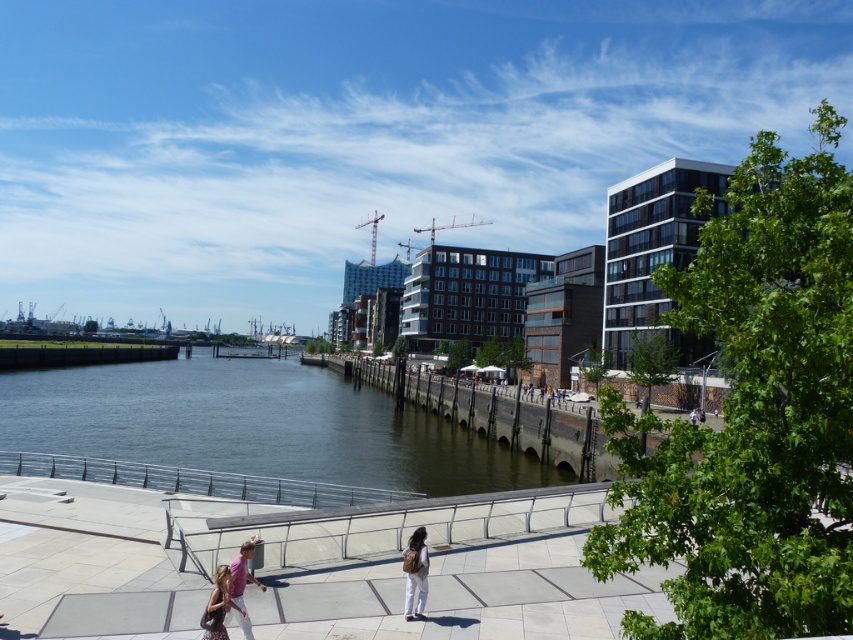
Does light brown backpack at center have a smaller size compared to pink fabric at lower center?

Indeed, light brown backpack at center has a smaller size compared to pink fabric at lower center.

Does light brown backpack at center have a greater width compared to pink fabric at lower center?

No.

Who is more forward, (410, 545) or (241, 579)?

Point (241, 579) is more forward.

The height and width of the screenshot is (640, 853). I want to click on light brown backpack at center, so click(415, 572).

Between dark gray concrete river at center and matte pink backpack at lower left, which one has more height?

With more height is dark gray concrete river at center.

Can you confirm if dark gray concrete river at center is positioned above matte pink backpack at lower left?

No.

Which is in front, point (59, 381) or point (219, 600)?

Point (219, 600)

Find the location of `dark gray concrete river at center`. dark gray concrete river at center is located at coordinates (251, 426).

Does dark gray concrete river at center appear on the right side of light brown backpack at center?

Incorrect, dark gray concrete river at center is not on the right side of light brown backpack at center.

Can you confirm if dark gray concrete river at center is thinner than light brown backpack at center?

In fact, dark gray concrete river at center might be wider than light brown backpack at center.

Does point (244, 429) lie in front of point (422, 595)?

No, it is behind (422, 595).

At what (x,y) coordinates should I click in order to perform the action: click on dark gray concrete river at center. Please return your answer as a coordinate pair (x, y). Looking at the image, I should click on (251, 426).